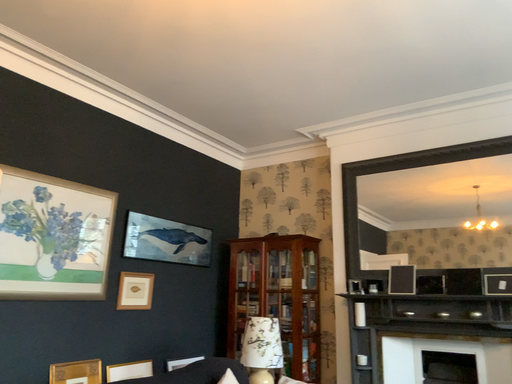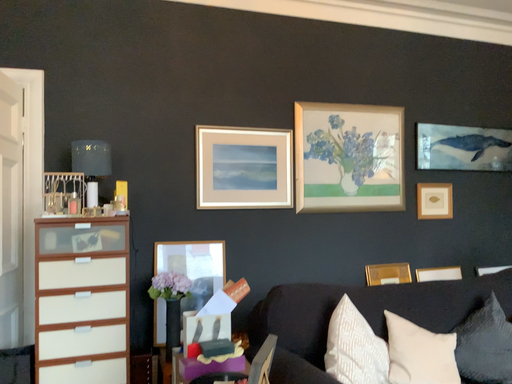
Question: Which way did the camera rotate in the video?

Choices:
 (A) rotated right
 (B) rotated left

Answer: (B)